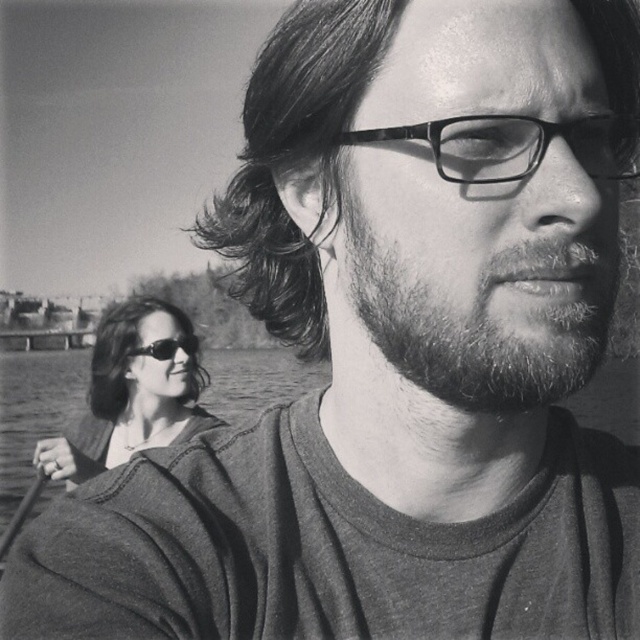
Looking at this image, you are a photographer trying to adjust the focus of your camera. You notice two people in the image. One has dark brown textured hair at center and the other has dark shiny hair at lower left. Which person is positioned to the right of the other?

The dark brown textured hair at center is positioned on the right side of dark shiny hair at lower left.

Looking at the man in the black and white photo, which feature is larger between the dark brown textured hair at center and the bearded at center?

The dark brown textured hair at center is bigger than the bearded at center.

You are a photographer trying to capture a group photo of the bearded at center and the other person in the background. The camera you have can only focus on subjects within 1 meter. Will both subjects be in focus?

The bearded at center and camera are 96.65 centimeters apart. Since 96.65 cm is less than 1 meter, the bearded at center will be in focus. However, the other person in the background is farther away, so they might not be in focus. Therefore, only the bearded at center will be in focus.